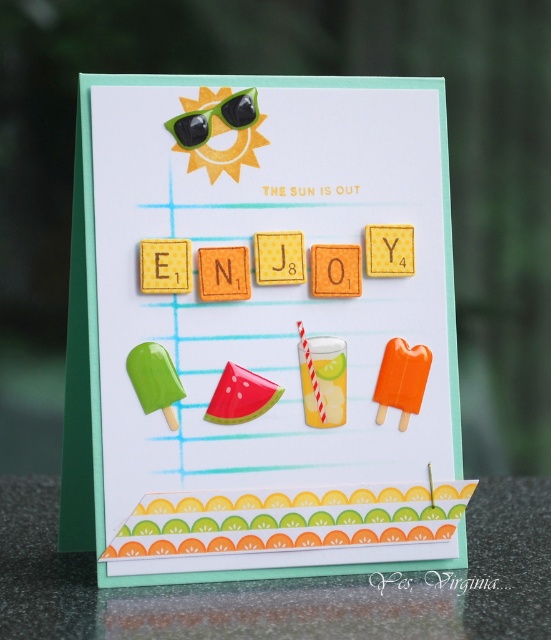
Question: Which point is closer to the camera taking this photo?

Choices:
 (A) (143, 595)
 (B) (193, 145)

Answer: (A)

Question: Is green paper at lower center smaller than green matte sunglasses at upper center?

Choices:
 (A) no
 (B) yes

Answer: (A)

Question: Can you confirm if green paper at lower center is thinner than green matte sunglasses at upper center?

Choices:
 (A) no
 (B) yes

Answer: (A)

Question: Is green paper at lower center to the right of green matte sunglasses at upper center from the viewer's perspective?

Choices:
 (A) yes
 (B) no

Answer: (A)